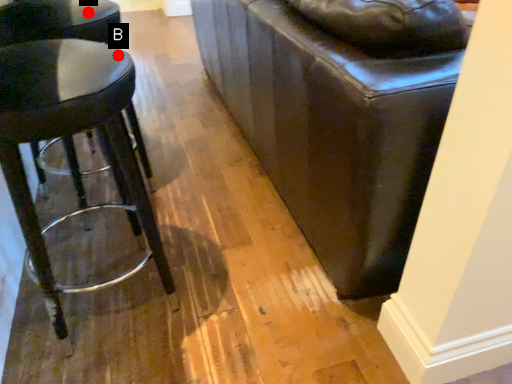
Question: Two points are circled on the image, labeled by A and B beside each circle. Which point is farther from the camera taking this photo?

Choices:
 (A) A is further
 (B) B is further

Answer: (A)